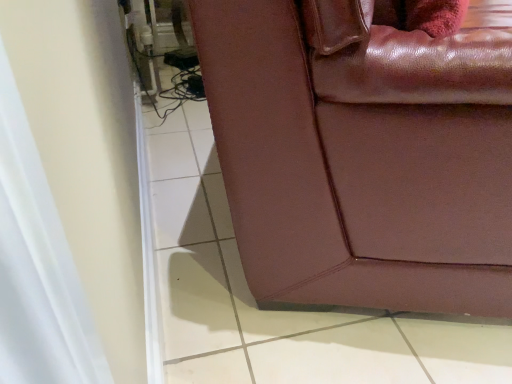
Question: Should I look upward or downward to see leather couch at lower right?

Choices:
 (A) down
 (B) up

Answer: (B)